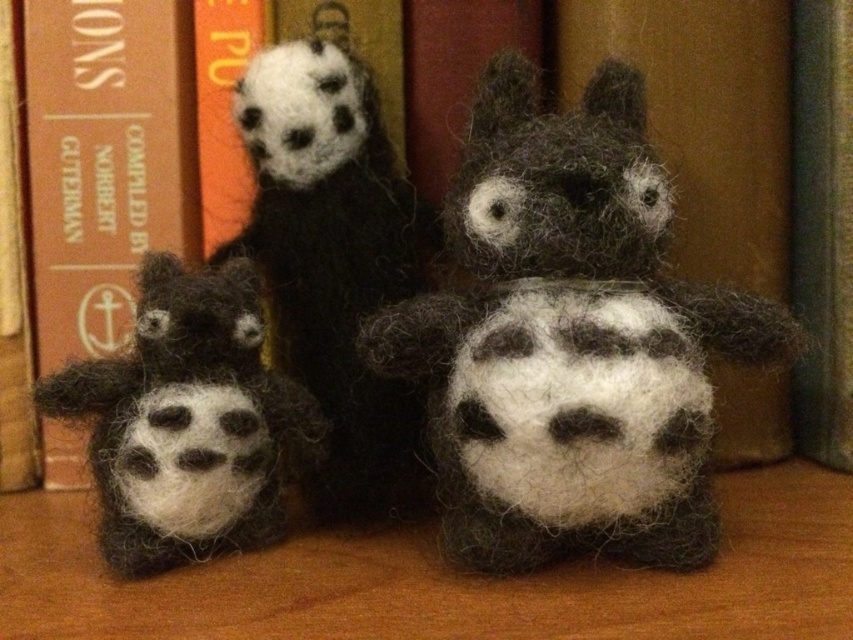
Question: Can you confirm if dark gray woolen plush at center is positioned to the left of fluffy black and white panda at center?

Choices:
 (A) no
 (B) yes

Answer: (A)

Question: Is fluffy black and white panda at center smaller than fuzzy black and white plush at lower left?

Choices:
 (A) no
 (B) yes

Answer: (A)

Question: Is dark gray woolen plush at center positioned before brown leather book at left?

Choices:
 (A) yes
 (B) no

Answer: (A)

Question: Which point appears farthest from the camera in this image?

Choices:
 (A) (358, 449)
 (B) (621, 246)

Answer: (A)

Question: Which object is closer to the camera taking this photo?

Choices:
 (A) dark gray woolen plush at center
 (B) fuzzy black and white plush at lower left
 (C) brown leather book at left

Answer: (A)

Question: Which of the following is the farthest from the observer?

Choices:
 (A) dark gray woolen plush at center
 (B) brown leather book at left
 (C) fuzzy black and white plush at lower left
 (D) fluffy black and white panda at center

Answer: (B)